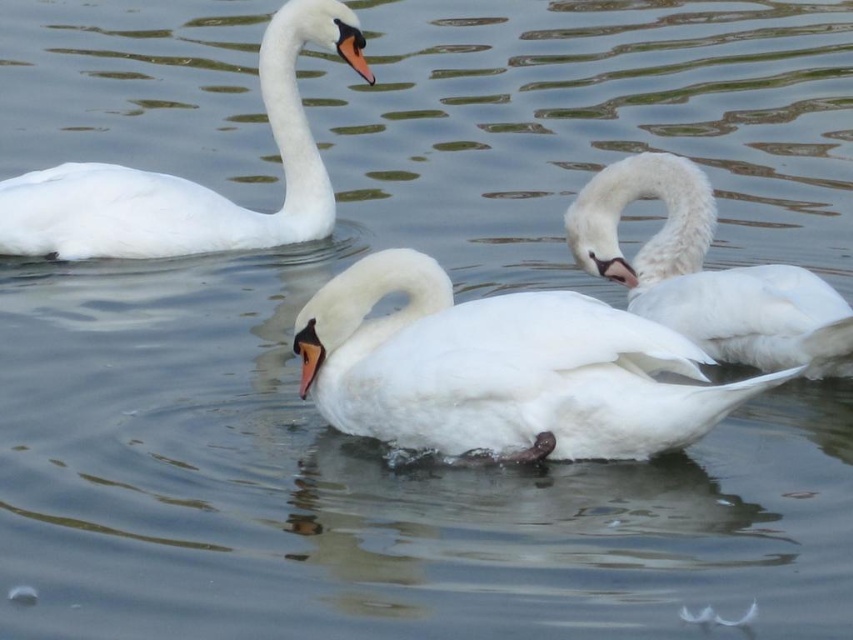
You are a photographer trying to capture the three swans in the image. You notice that the white matte swan at center is exactly at point (502, 369). If you want to frame all three swans in your shot, where should you position your camera relative to the white matte swan at center?

To frame all three swans, position your camera slightly to the side of the white matte swan at center, ensuring the other two swans are within the frame. Since the white matte swan at center is at point (502, 369), adjusting the camera angle slightly left or right would capture all three swans while keeping the central swan in focus.